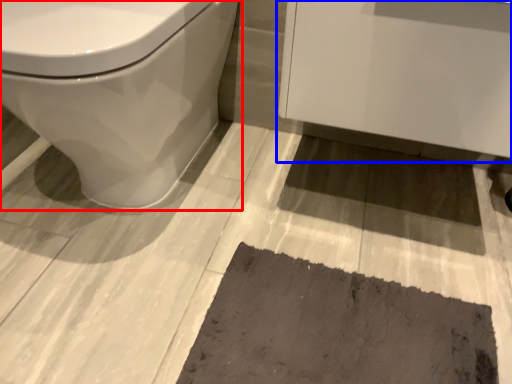
Question: Which point is further to the camera, toilet (highlighted by a red box) or porcelain (highlighted by a blue box)?

Choices:
 (A) toilet
 (B) porcelain

Answer: (B)